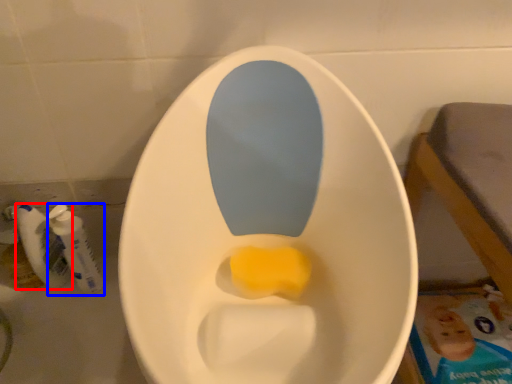
Question: Which point is closer to the camera, mouthwash (highlighted by a red box) or mouthwash (highlighted by a blue box)?

Choices:
 (A) mouthwash
 (B) mouthwash

Answer: (B)